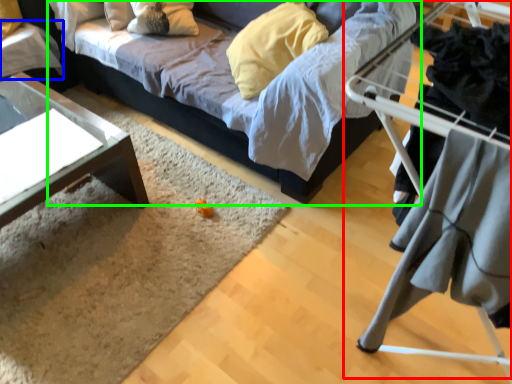
Question: Which object is the closest to the bunk bed (highlighted by a red box)? Choose among these: table (highlighted by a blue box) or studio couch (highlighted by a green box).

Choices:
 (A) table
 (B) studio couch

Answer: (B)